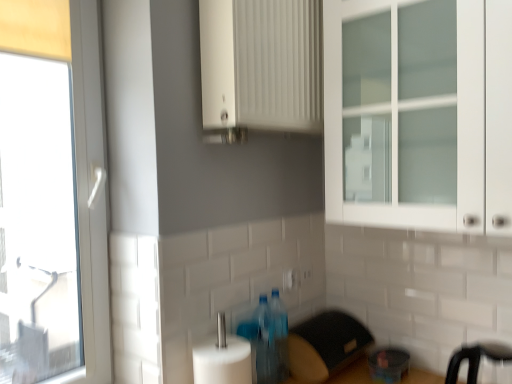
Question: Is white glass cabinet at upper right spatially inside white plastic electric outlet at center, which is counted as the first electric outlet, starting from the left, or outside of it?

Choices:
 (A) outside
 (B) inside

Answer: (A)

Question: Does point (484, 99) appear closer or farther from the camera than point (290, 269)?

Choices:
 (A) farther
 (B) closer

Answer: (B)

Question: Estimate the real-world distances between objects in this image. Which object is closer to the white plastic electric outlet at center, the 2th electric outlet in the back-to-front sequence?

Choices:
 (A) translucent plastic bottles at lower center, the 1th bottle from the front
 (B) translucent plastic bottle at center, the first bottle viewed from the back
 (C) white glass cabinet at upper right
 (D) black plastic bar stool at lower right
 (E) white matte cabinet at upper center

Answer: (B)

Question: Estimate the real-world distances between objects in this image. Which object is farther from the white plastic electric outlet at center, which is counted as the first electric outlet, starting from the left?

Choices:
 (A) black plastic toaster at lower center, acting as the first appliance starting from the left
 (B) transparent glass window at left
 (C) translucent plastic bottles at lower center, the 1th bottle from the front
 (D) white plastic electric outlet at center, which appears as the 2th electric outlet when viewed from the left
 (E) translucent plastic bottle at center, the first bottle viewed from the back

Answer: (B)